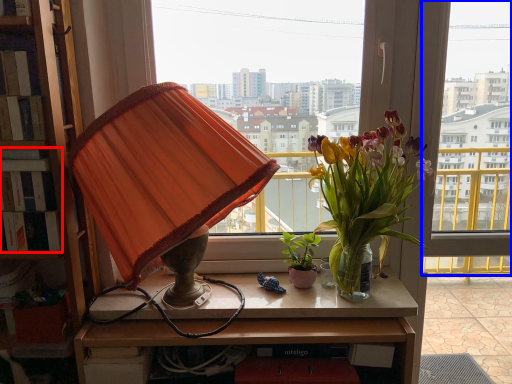
Question: Which point is closer to the camera, book (highlighted by a red box) or window (highlighted by a blue box)?

Choices:
 (A) book
 (B) window

Answer: (A)